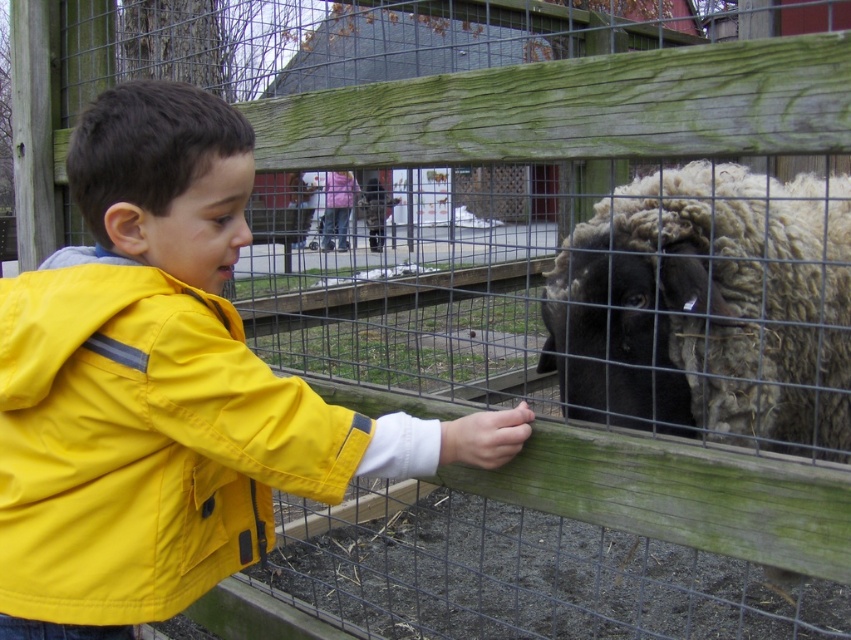
What is the exact coordinate position of the yellow matte jacket at center in the image?

The yellow matte jacket at center is located at point [164,387].